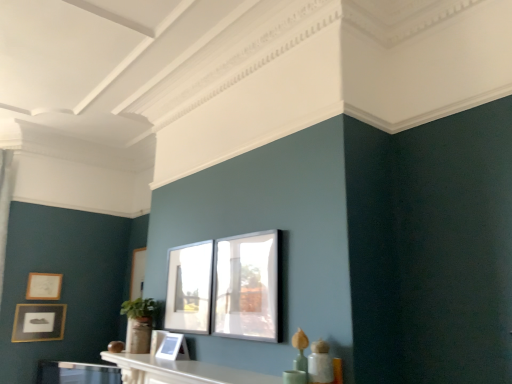
The height and width of the screenshot is (384, 512). What are the coordinates of `free point in front of matte white picture frame at center, the 3th picture frame when ordered from left to right` in the screenshot? It's located at (163, 362).